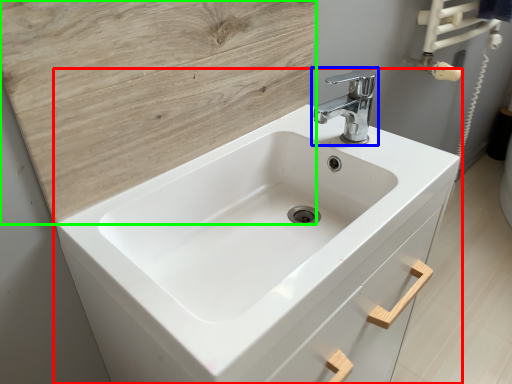
Question: Which is farther away from sink (highlighted by a red box)? tap (highlighted by a blue box) or plywood (highlighted by a green box)?

Choices:
 (A) tap
 (B) plywood

Answer: (A)